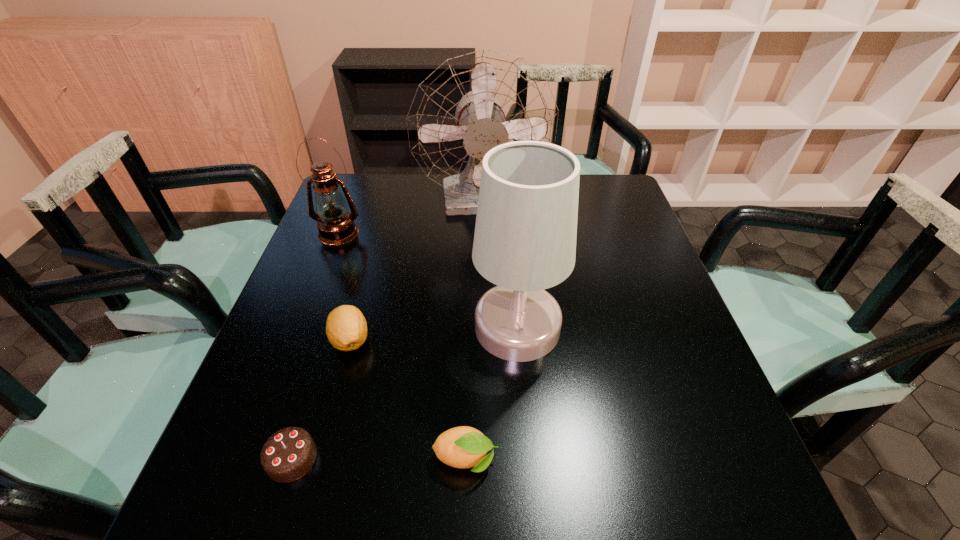
Identify the location of vacant space in between the chocolate cake and the right lemon. (379, 459).

Identify the location of empty location between the oil lamp and the lampshade. (428, 280).

This screenshot has height=540, width=960. I want to click on free space between the oil lamp and the fan, so click(x=411, y=218).

Identify the location of vacant point located between the fan and the oil lamp. The image size is (960, 540). (411, 218).

Identify the location of free space between the farther lemon and the nearer lemon. (408, 400).

Point out which object is positioned as the second nearest to the lampshade. Please provide its 2D coordinates. Your answer should be formatted as a tuple, i.e. [(x, y)], where the tuple contains the x and y coordinates of a point satisfying the conditions above.

[(346, 328)]

You are a GUI agent. You are given a task and a screenshot of the screen. Output one action in this format:
    pyautogui.click(x=<x>, y=<y>)
    Task: Click on the object that is the third closest to the shortest object
    
    Given the screenshot: What is the action you would take?
    [525, 234]

Identify the location of vacant region that satisfies the following two spatial constraints: 1. on the base of the lampshade; 2. at the stem end of the farther lemon. (518, 340).

At what (x,y) coordinates should I click in order to perform the action: click on free space that satisfies the following two spatial constraints: 1. on the base of the lampshade; 2. at the stem end of the farther lemon. Please return your answer as a coordinate pair (x, y). This screenshot has height=540, width=960. Looking at the image, I should click on (518, 340).